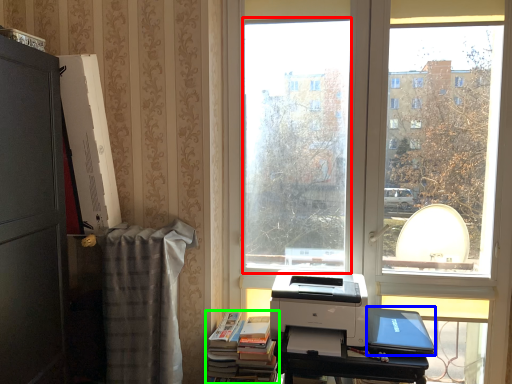
Question: Estimate the real-world distances between objects in this image. Which object is farther from window screen (highlighted by a red box), laptop (highlighted by a blue box) or book (highlighted by a green box)?

Choices:
 (A) laptop
 (B) book

Answer: (A)